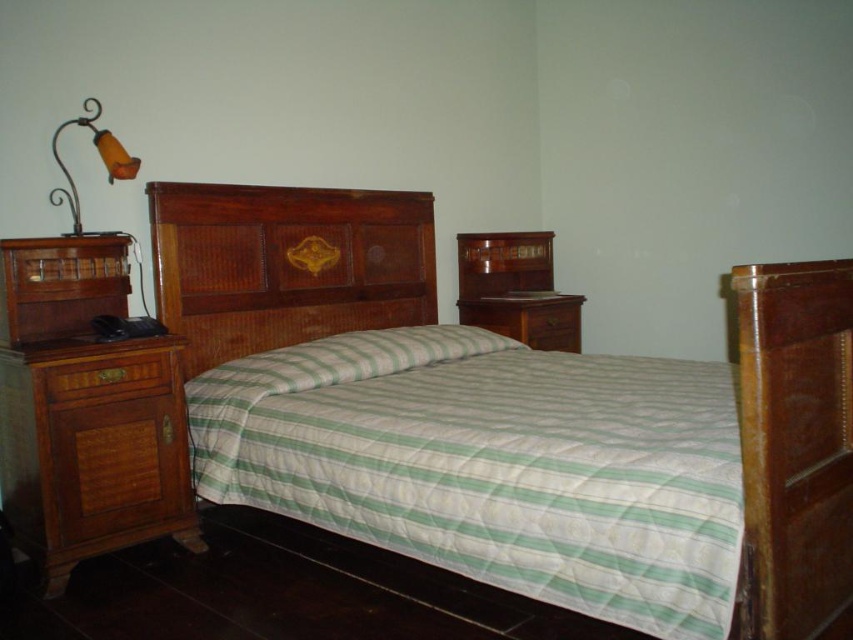
Who is higher up, brown wood dresser at left or mahogany wood armoire at center?

mahogany wood armoire at center is higher up.

Which is in front, point (0, 282) or point (532, 252)?

Positioned in front is point (0, 282).

This screenshot has height=640, width=853. Describe the element at coordinates (86, 410) in the screenshot. I see `brown wood dresser at left` at that location.

Identify the location of brown wood dresser at left. (86, 410).

Find the location of a particular element. matte yellow glass lamp at upper left is located at coordinates (99, 156).

Who is higher up, matte yellow glass lamp at upper left or brown wood drawer at center?

matte yellow glass lamp at upper left is higher up.

Is point (67, 177) positioned behind point (544, 337)?

No, (67, 177) is in front of (544, 337).

The width and height of the screenshot is (853, 640). What are the coordinates of `matte yellow glass lamp at upper left` in the screenshot? It's located at (99, 156).

Based on the photo, does wooden bed at center come in front of mahogany wood armoire at center?

Yes.

Find the location of `wooden bed at center`. wooden bed at center is located at coordinates (511, 420).